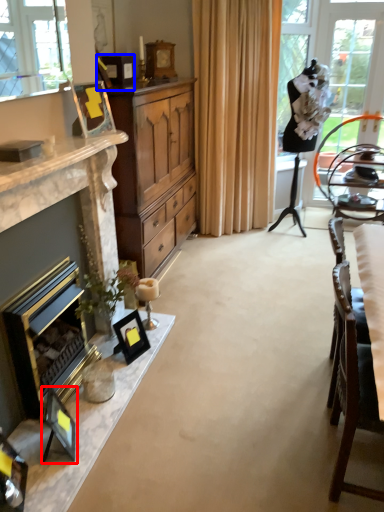
Question: Which object appears farthest to the camera in this image, picture frame (highlighted by a red box) or picture frame (highlighted by a blue box)?

Choices:
 (A) picture frame
 (B) picture frame

Answer: (B)